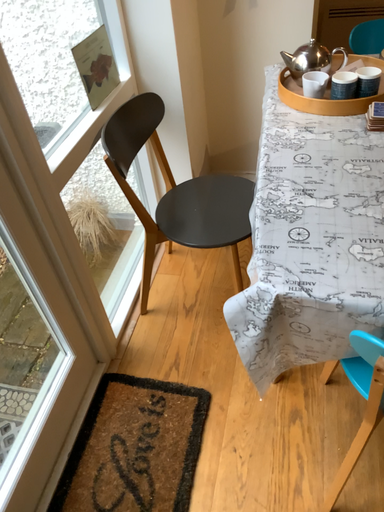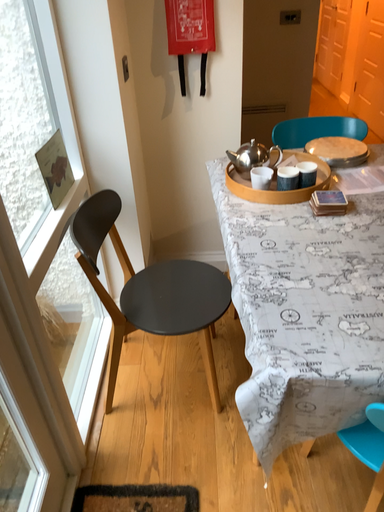
Question: Which way did the camera rotate in the video?

Choices:
 (A) rotated downward
 (B) rotated upward

Answer: (B)